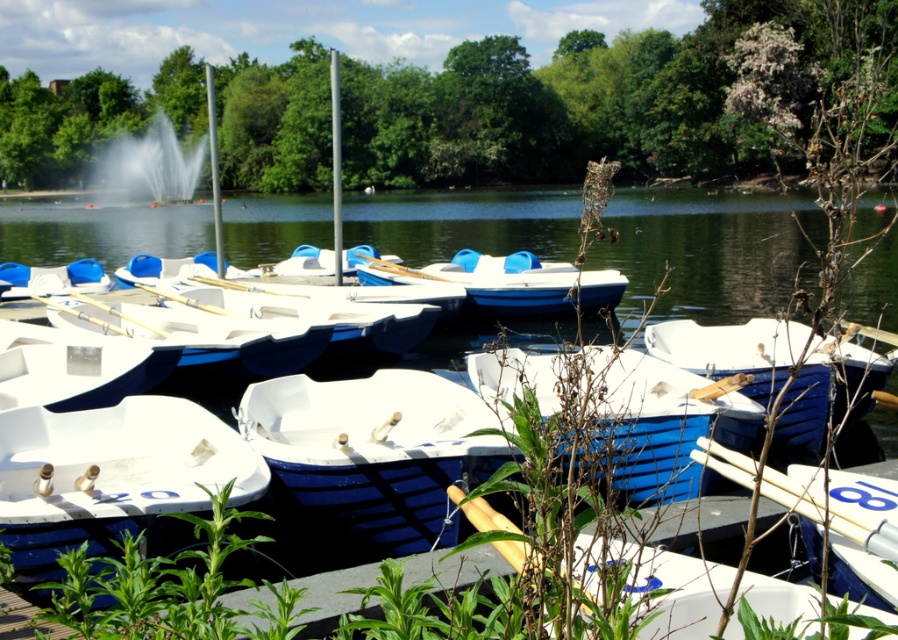
You are planning to take a photo of the white matte boat at center and the white water at center from the pier. Which object will appear smaller in your photo?

The white matte boat at center will appear smaller in the photo because it is shorter than the white water at center.

You are planning to rent a boat and need to know if the white matte boat at center is floating on the white water at center. Based on the scene description, can you determine this?

The white matte boat at center is located below the white water at center, which means it is submerged or positioned under the water, so it is likely floating on the white water at center.